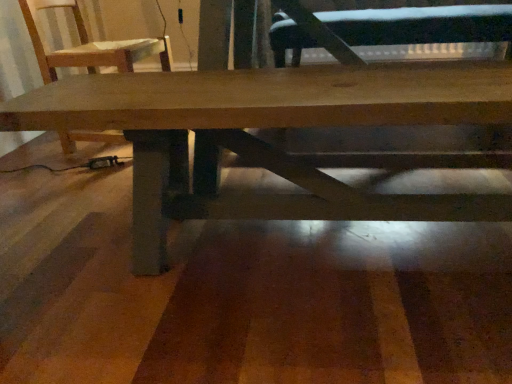
Question: Is wooden chair at upper left inside black leather swivel chair at center?

Choices:
 (A) no
 (B) yes

Answer: (A)

Question: Is black leather swivel chair at center further to camera compared to wooden chair at upper left?

Choices:
 (A) yes
 (B) no

Answer: (A)

Question: Is black leather swivel chair at center closer to camera compared to wooden chair at upper left?

Choices:
 (A) no
 (B) yes

Answer: (A)

Question: Is black leather swivel chair at center far from wooden chair at upper left?

Choices:
 (A) no
 (B) yes

Answer: (A)

Question: Is black leather swivel chair at center taller than wooden chair at upper left?

Choices:
 (A) yes
 (B) no

Answer: (B)

Question: From a real-world perspective, relative to natural wood table at center, is black leather swivel chair at center vertically above or below?

Choices:
 (A) above
 (B) below

Answer: (A)

Question: In terms of height, does black leather swivel chair at center look taller or shorter compared to natural wood table at center?

Choices:
 (A) short
 (B) tall

Answer: (A)

Question: In terms of width, does black leather swivel chair at center look wider or thinner when compared to natural wood table at center?

Choices:
 (A) thin
 (B) wide

Answer: (B)

Question: Looking at the image, does black leather swivel chair at center seem bigger or smaller compared to natural wood table at center?

Choices:
 (A) small
 (B) big

Answer: (B)

Question: From a real-world perspective, is natural wood table at center physically located above or below black leather swivel chair at center?

Choices:
 (A) above
 (B) below

Answer: (B)

Question: Is point (42, 122) positioned closer to the camera than point (297, 41)?

Choices:
 (A) closer
 (B) farther

Answer: (A)

Question: Is natural wood table at center in front of or behind black leather swivel chair at center in the image?

Choices:
 (A) front
 (B) behind

Answer: (A)

Question: In terms of height, does natural wood table at center look taller or shorter compared to black leather swivel chair at center?

Choices:
 (A) short
 (B) tall

Answer: (B)

Question: Is wooden chair at upper left wider or thinner than natural wood table at center?

Choices:
 (A) wide
 (B) thin

Answer: (A)

Question: Is point (123, 59) closer or farther from the camera than point (155, 240)?

Choices:
 (A) closer
 (B) farther

Answer: (B)